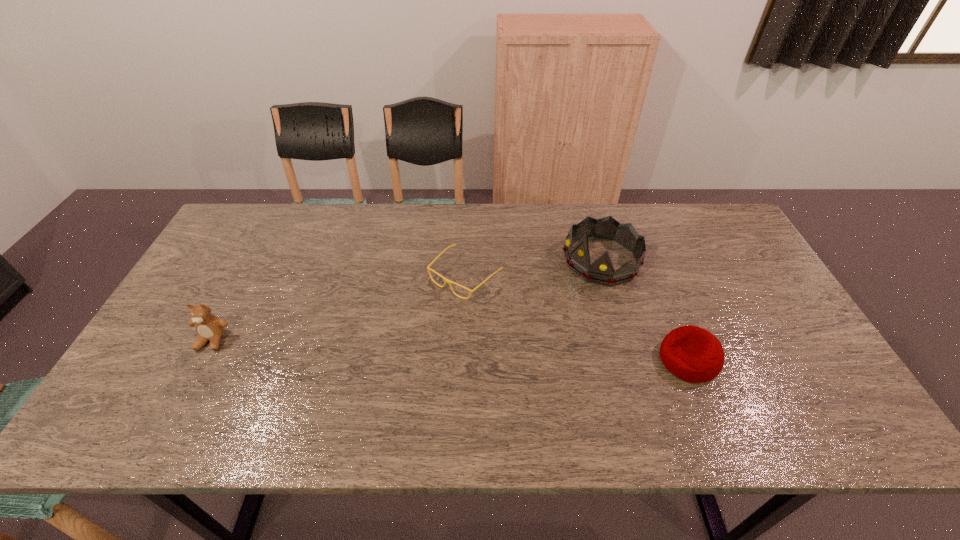
Identify the location of free space at the left edge of the desktop. This screenshot has height=540, width=960. (209, 273).

Identify the location of vacant space at the right edge. (759, 338).

This screenshot has width=960, height=540. Identify the location of vacant space at the far left corner. (252, 206).

Find the location of a particular element. This screenshot has width=960, height=540. vacant area that lies between the beanbag and the leftmost object is located at coordinates (450, 350).

This screenshot has width=960, height=540. I want to click on vacant area that lies between the third object from right to left and the tallest object, so click(x=534, y=268).

Where is `vacant area between the tiara and the second shortest object`? The width and height of the screenshot is (960, 540). vacant area between the tiara and the second shortest object is located at coordinates (645, 310).

Locate an element on the screen. Image resolution: width=960 pixels, height=540 pixels. free point between the shortest object and the tiara is located at coordinates (534, 268).

What are the coordinates of `empty space between the third tallest object and the third shortest object` in the screenshot? It's located at (450, 350).

Locate an element on the screen. empty location between the tallest object and the spectacles is located at coordinates (534, 268).

You are a GUI agent. You are given a task and a screenshot of the screen. Output one action in this format:
    pyautogui.click(x=<x>, y=<y>)
    Task: Click on the vacant space in between the third tallest object and the third shortest object
    The height and width of the screenshot is (540, 960).
    Given the screenshot: What is the action you would take?
    pyautogui.click(x=450, y=350)